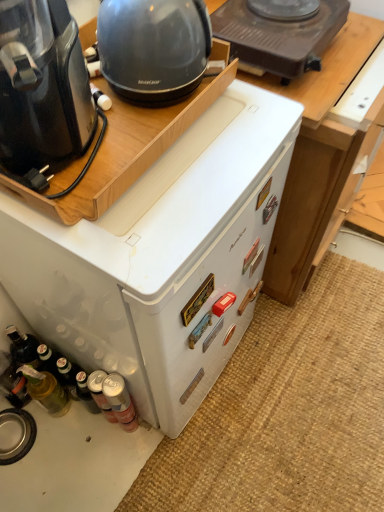
Where is `metallic silver can at lower left, arranged as the 2th bottle when viewed from the left`? metallic silver can at lower left, arranged as the 2th bottle when viewed from the left is located at coordinates (100, 394).

What is the approximate height of brown plastic stove at upper center?

The height of brown plastic stove at upper center is 3.89 inches.

This screenshot has width=384, height=512. Find the location of `white matte refrigerator at center, positioned as the second home appliance in front-to-back order`. white matte refrigerator at center, positioned as the second home appliance in front-to-back order is located at coordinates (162, 258).

The height and width of the screenshot is (512, 384). Describe the element at coordinates (162, 258) in the screenshot. I see `white matte refrigerator at center, the 1th home appliance in the back-to-front sequence` at that location.

What do you see at coordinates (319, 158) in the screenshot?
I see `white wood table at center` at bounding box center [319, 158].

The width and height of the screenshot is (384, 512). Find the location of `metallic silver can at lower left, the first bottle in the right-to-left sequence`. metallic silver can at lower left, the first bottle in the right-to-left sequence is located at coordinates (120, 401).

This screenshot has width=384, height=512. Describe the element at coordinates (153, 48) in the screenshot. I see `matte black kettle at upper left` at that location.

The height and width of the screenshot is (512, 384). I want to click on matte black kettle at upper left, so click(153, 48).

This screenshot has height=512, width=384. What do you see at coordinates (42, 85) in the screenshot?
I see `black plastic coffee maker at left, arranged as the 1th home appliance when viewed from the front` at bounding box center [42, 85].

Where is `translucent glass bottle at lower left, acting as the first bottle starting from the left`? translucent glass bottle at lower left, acting as the first bottle starting from the left is located at coordinates (46, 390).

Which is behind, point (120, 390) or point (60, 22)?

Point (120, 390)

Which object is further away from the camera, metallic silver can at lower left, the first bottle in the right-to-left sequence, or black plastic coffee maker at left, arranged as the 1th home appliance when viewed from the front?

metallic silver can at lower left, the first bottle in the right-to-left sequence, is more distant.

Can you confirm if metallic silver can at lower left, the first bottle in the right-to-left sequence, is positioned to the left of black plastic coffee maker at left, arranged as the 1th home appliance when viewed from the front?

No, metallic silver can at lower left, the first bottle in the right-to-left sequence, is not to the left of black plastic coffee maker at left, arranged as the 1th home appliance when viewed from the front.

Is black plastic coffee maker at left, arranged as the 1th home appliance when viewed from the front, at the back of metallic silver can at lower left, the first bottle in the right-to-left sequence?

No, metallic silver can at lower left, the first bottle in the right-to-left sequence, is not facing the opposite direction of black plastic coffee maker at left, arranged as the 1th home appliance when viewed from the front.

Is white wood table at center facing away from metallic silver can at lower left, arranged as the 2th bottle when viewed from the left?

No, white wood table at center is not facing away from metallic silver can at lower left, arranged as the 2th bottle when viewed from the left.

Does white wood table at center have a greater height compared to metallic silver can at lower left, arranged as the 2th bottle when viewed from the left?

Indeed, white wood table at center has a greater height compared to metallic silver can at lower left, arranged as the 2th bottle when viewed from the left.

From the image's perspective, does white wood table at center appear higher than metallic silver can at lower left, which is the second bottle from right to left?

Yes.

Is metallic silver can at lower left, arranged as the 2th bottle when viewed from the left, a part of white wood table at center?

That's incorrect, metallic silver can at lower left, arranged as the 2th bottle when viewed from the left, is not inside white wood table at center.

In terms of height, does matte black kettle at upper left look taller or shorter compared to white matte refrigerator at center, positioned as the second home appliance in front-to-back order?

matte black kettle at upper left is shorter than white matte refrigerator at center, positioned as the second home appliance in front-to-back order.

How far apart are matte black kettle at upper left and white matte refrigerator at center, the 1th home appliance in the back-to-front sequence?

They are 34.08 centimeters apart.

Is matte black kettle at upper left not within white matte refrigerator at center, the 1th home appliance in the back-to-front sequence?

matte black kettle at upper left is positioned outside white matte refrigerator at center, the 1th home appliance in the back-to-front sequence.

How different are the orientations of matte black kettle at upper left and white matte refrigerator at center, the 1th home appliance in the back-to-front sequence, in degrees?

There is a 0.58-degree angle between the facing directions of matte black kettle at upper left and white matte refrigerator at center, the 1th home appliance in the back-to-front sequence.

This screenshot has height=512, width=384. There is a brown plastic stove at upper center. Identify the location of appliance above it (from a real-world perspective). (153, 48).

Considering the positions of point (335, 29) and point (102, 10), is point (335, 29) closer or farther from the camera than point (102, 10)?

Point (335, 29) is positioned farther from the camera compared to point (102, 10).

From the image's perspective, is brown plastic stove at upper center located above matte black kettle at upper left?

Yes, from the image's perspective, brown plastic stove at upper center is on top of matte black kettle at upper left.

Is brown plastic stove at upper center turned away from matte black kettle at upper left?

No, brown plastic stove at upper center is not facing away from matte black kettle at upper left.

Considering the relative sizes of metallic silver can at lower left, the first bottle in the right-to-left sequence, and brown plastic stove at upper center in the image provided, is metallic silver can at lower left, the first bottle in the right-to-left sequence, wider than brown plastic stove at upper center?

Incorrect, the width of metallic silver can at lower left, the first bottle in the right-to-left sequence, does not surpass that of brown plastic stove at upper center.

From the picture: Considering the positions of objects metallic silver can at lower left, the 3th bottle viewed from the left, and brown plastic stove at upper center in the image provided, who is more to the left, metallic silver can at lower left, the 3th bottle viewed from the left, or brown plastic stove at upper center?

metallic silver can at lower left, the 3th bottle viewed from the left, is more to the left.

Consider the image. Considering the sizes of objects metallic silver can at lower left, the first bottle in the right-to-left sequence, and brown plastic stove at upper center in the image provided, who is shorter, metallic silver can at lower left, the first bottle in the right-to-left sequence, or brown plastic stove at upper center?

brown plastic stove at upper center.

Where is `kitchen appliance above the metallic silver can at lower left, the 3th bottle viewed from the left (from the image's perspective)`? This screenshot has width=384, height=512. kitchen appliance above the metallic silver can at lower left, the 3th bottle viewed from the left (from the image's perspective) is located at coordinates (279, 35).

What's the angular difference between white wood table at center and translucent glass bottle at lower left, acting as the first bottle starting from the left,'s facing directions?

They differ by 0.00125 degrees in their facing directions.

What are the coordinates of `table located above the translucent glass bottle at lower left, acting as the first bottle starting from the left (from a real-world perspective)` in the screenshot? It's located at (319, 158).

Which is closer, (347, 34) or (63, 413)?

The point (347, 34) is in front.

Is white wood table at center to the left of translucent glass bottle at lower left, acting as the first bottle starting from the left, from the viewer's perspective?

No.

Looking at this image, who is smaller, white matte refrigerator at center, positioned as the second home appliance in front-to-back order, or metallic silver can at lower left, the first bottle in the right-to-left sequence?

metallic silver can at lower left, the first bottle in the right-to-left sequence, is smaller.

Considering the positions of objects white matte refrigerator at center, the 1th home appliance in the back-to-front sequence, and metallic silver can at lower left, the first bottle in the right-to-left sequence, in the image provided, who is more to the right, white matte refrigerator at center, the 1th home appliance in the back-to-front sequence, or metallic silver can at lower left, the first bottle in the right-to-left sequence,?

Positioned to the right is white matte refrigerator at center, the 1th home appliance in the back-to-front sequence.

From a real-world perspective, is white matte refrigerator at center, the 1th home appliance in the back-to-front sequence, under metallic silver can at lower left, the first bottle in the right-to-left sequence?

No, from a real-world perspective, white matte refrigerator at center, the 1th home appliance in the back-to-front sequence, is not under metallic silver can at lower left, the first bottle in the right-to-left sequence.

You are a GUI agent. You are given a task and a screenshot of the screen. Output one action in this format:
    pyautogui.click(x=<x>, y=<y>)
    Task: Click on the 3rd bottle below when counting from the black plastic coffee maker at left, marked as the second home appliance in a back-to-front arrangement (from the image's perspective)
    This screenshot has height=512, width=384.
    Given the screenshot: What is the action you would take?
    pyautogui.click(x=120, y=401)

Find the location of a particular element. table above the metallic silver can at lower left, which is the second bottle from right to left (from a real-world perspective) is located at coordinates (319, 158).

Based on their spatial positions, is brown plastic stove at upper center or translucent glass bottle at lower left, which is the third bottle in right-to-left order, further from metallic silver can at lower left, the first bottle in the right-to-left sequence?

brown plastic stove at upper center.

When comparing their distances from brown plastic stove at upper center, does translucent glass bottle at lower left, acting as the first bottle starting from the left, or black plastic coffee maker at left, arranged as the 1th home appliance when viewed from the front, seem further?

translucent glass bottle at lower left, acting as the first bottle starting from the left, is positioned further to the anchor brown plastic stove at upper center.

Consider the image. Estimate the real-world distances between objects in this image. Which object is closer to metallic silver can at lower left, which is the second bottle from right to left, translucent glass bottle at lower left, acting as the first bottle starting from the left, or metallic silver can at lower left, the first bottle in the right-to-left sequence?

metallic silver can at lower left, the first bottle in the right-to-left sequence.

Looking at this image, when comparing their distances from metallic silver can at lower left, the first bottle in the right-to-left sequence, does white matte refrigerator at center, positioned as the second home appliance in front-to-back order, or metallic silver can at lower left, arranged as the 2th bottle when viewed from the left, seem further?

white matte refrigerator at center, positioned as the second home appliance in front-to-back order, is further to metallic silver can at lower left, the first bottle in the right-to-left sequence.

From the image, which object appears to be farther from matte black kettle at upper left, metallic silver can at lower left, the first bottle in the right-to-left sequence, or white matte refrigerator at center, the 1th home appliance in the back-to-front sequence?

Based on the image, metallic silver can at lower left, the first bottle in the right-to-left sequence, appears to be further to matte black kettle at upper left.

When comparing their distances from white wood table at center, does metallic silver can at lower left, the first bottle in the right-to-left sequence, or matte black kettle at upper left seem further?

metallic silver can at lower left, the first bottle in the right-to-left sequence, is further to white wood table at center.

When comparing their distances from metallic silver can at lower left, the first bottle in the right-to-left sequence, does white wood table at center or white matte refrigerator at center, the 1th home appliance in the back-to-front sequence, seem further?

Among the two, white wood table at center is located further to metallic silver can at lower left, the first bottle in the right-to-left sequence.

Which object lies further to the anchor point white matte refrigerator at center, positioned as the second home appliance in front-to-back order, matte black kettle at upper left or metallic silver can at lower left, the first bottle in the right-to-left sequence?

The object further to white matte refrigerator at center, positioned as the second home appliance in front-to-back order, is matte black kettle at upper left.

The image size is (384, 512). I want to click on home appliance situated between black plastic coffee maker at left, arranged as the 1th home appliance when viewed from the front, and white wood table at center from left to right, so click(x=162, y=258).

Where is `bottle between matte black kettle at upper left and metallic silver can at lower left, which is the second bottle from right to left, vertically`? The height and width of the screenshot is (512, 384). bottle between matte black kettle at upper left and metallic silver can at lower left, which is the second bottle from right to left, vertically is located at coordinates (46, 390).

Locate an element on the screen. appliance between brown plastic stove at upper center and white matte refrigerator at center, positioned as the second home appliance in front-to-back order, from top to bottom is located at coordinates (153, 48).

Find the location of a particular element. appliance that lies between brown plastic stove at upper center and translucent glass bottle at lower left, which is the third bottle in right-to-left order, from top to bottom is located at coordinates (153, 48).